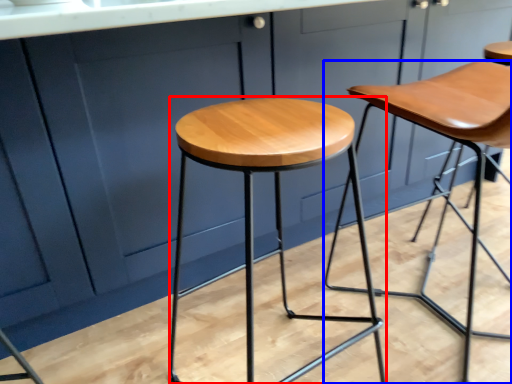
Question: Which object appears closest to the camera in this image, stool (highlighted by a red box) or stool (highlighted by a blue box)?

Choices:
 (A) stool
 (B) stool

Answer: (A)